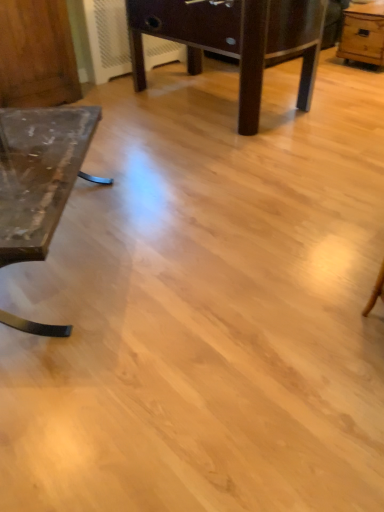
Where is `space that is in front of dark brown wooden table at center, marked as the second table in a right-to-left arrangement`? The width and height of the screenshot is (384, 512). space that is in front of dark brown wooden table at center, marked as the second table in a right-to-left arrangement is located at coordinates pos(230,170).